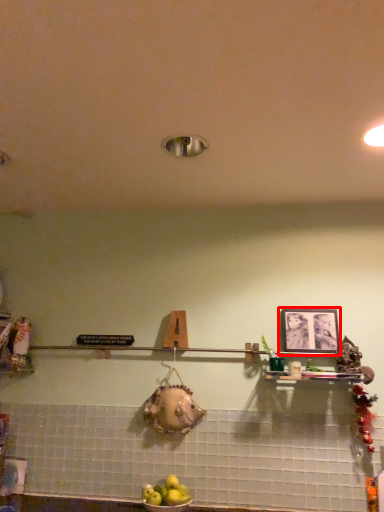
Question: From the image, what is the correct spatial relationship of picture frame (annotated by the red box) in relation to apple?

Choices:
 (A) left
 (B) right

Answer: (B)